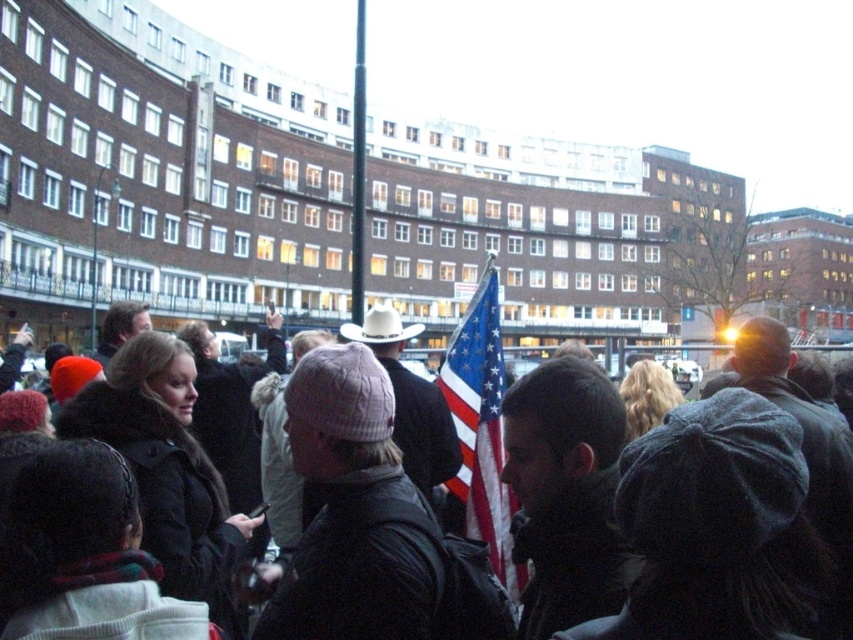
Measure the distance between point (463, 419) and camera.

Point (463, 419) and camera are 216.13 feet apart.

Consider the image. Does american flag at center have a greater width compared to white matte cowboy hat at center?

Incorrect, american flag at center's width does not surpass white matte cowboy hat at center's.

Is point (448, 385) positioned in front of point (370, 337)?

That is True.

At what (x,y) coordinates should I click in order to perform the action: click on american flag at center. Please return your answer as a coordinate pair (x, y). The image size is (853, 640). Looking at the image, I should click on (480, 426).

Locate an element on the screen. Image resolution: width=853 pixels, height=640 pixels. matte black jacket at center is located at coordinates (808, 472).

Image resolution: width=853 pixels, height=640 pixels. What do you see at coordinates (808, 472) in the screenshot? I see `matte black jacket at center` at bounding box center [808, 472].

Is point (827, 612) in front of point (457, 410)?

Yes, it is.

The height and width of the screenshot is (640, 853). What are the coordinates of `matte black jacket at center` in the screenshot? It's located at (808, 472).

Which is below, matte black jacket at center or white matte cowboy hat at center?

Positioned lower is matte black jacket at center.

Can you confirm if matte black jacket at center is smaller than white matte cowboy hat at center?

Actually, matte black jacket at center might be larger than white matte cowboy hat at center.

Which is behind, point (811, 582) or point (372, 323)?

Point (372, 323)

The width and height of the screenshot is (853, 640). What are the coordinates of `matte black jacket at center` in the screenshot? It's located at (808, 472).